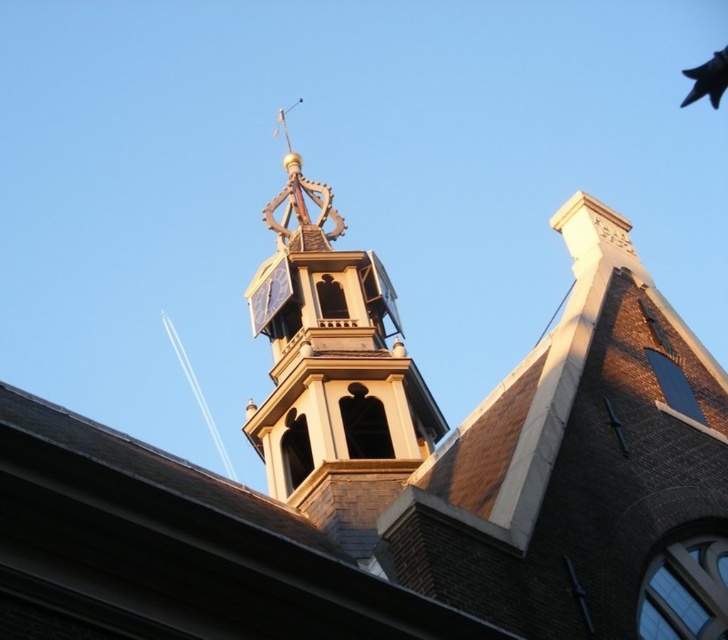
You are a birdwatcher observing the historic building. You see the golden brick bell tower at upper center and the black feathered pigeon at upper right. Which object is located higher in the image?

The black feathered pigeon at upper right is higher because the golden brick bell tower at upper center is positioned under it.

Consider the image. You are a birdwatcher observing the historic building. You notice a golden brick bell tower at upper center and a black feathered pigeon at upper right. Which object is taller?

The golden brick bell tower at upper center is much taller than the black feathered pigeon at upper right.

You are a birdwatcher observing the historic building. You notice the golden brick bell tower at upper center and the black feathered pigeon at upper right. Which object is larger in size?

The golden brick bell tower at upper center is smaller than the black feathered pigeon at upper right.